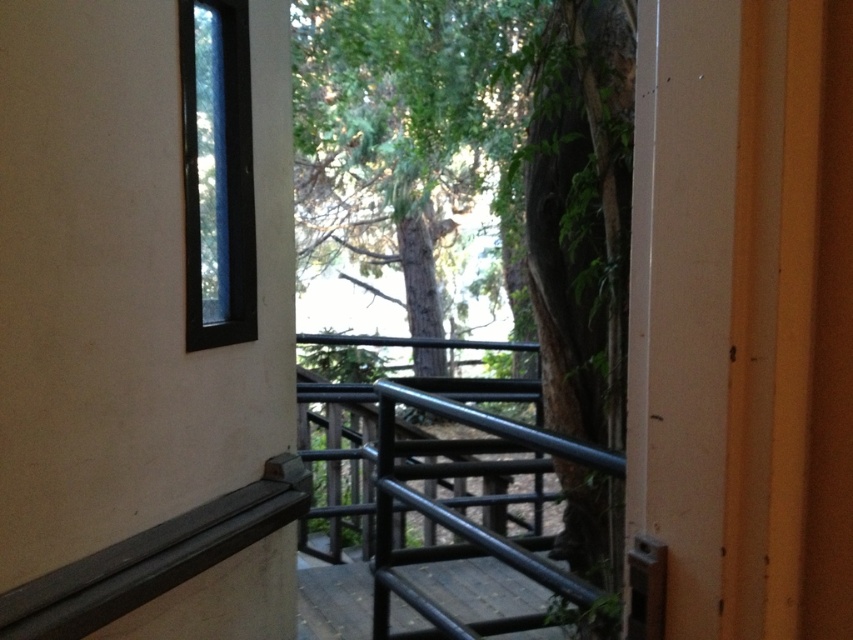
Question: Which object is closer to the camera taking this photo?

Choices:
 (A) black metal railing at center
 (B) black matte door at upper left
 (C) clear glass window at upper left

Answer: (B)

Question: Which point appears farthest from the camera in this image?

Choices:
 (A) (233, 468)
 (B) (486, 464)
 (C) (228, 182)
 (D) (618, 317)

Answer: (B)

Question: Can you confirm if black metal railing at center is positioned to the right of clear glass window at upper left?

Choices:
 (A) no
 (B) yes

Answer: (B)

Question: Does black matte door at upper left have a greater width compared to black metal railing at center?

Choices:
 (A) no
 (B) yes

Answer: (A)

Question: Does green leafy tree at center appear under black metal railing at center?

Choices:
 (A) no
 (B) yes

Answer: (A)

Question: Which object is closer to the camera taking this photo?

Choices:
 (A) green leafy tree at center
 (B) clear glass window at upper left
 (C) black matte door at upper left

Answer: (C)